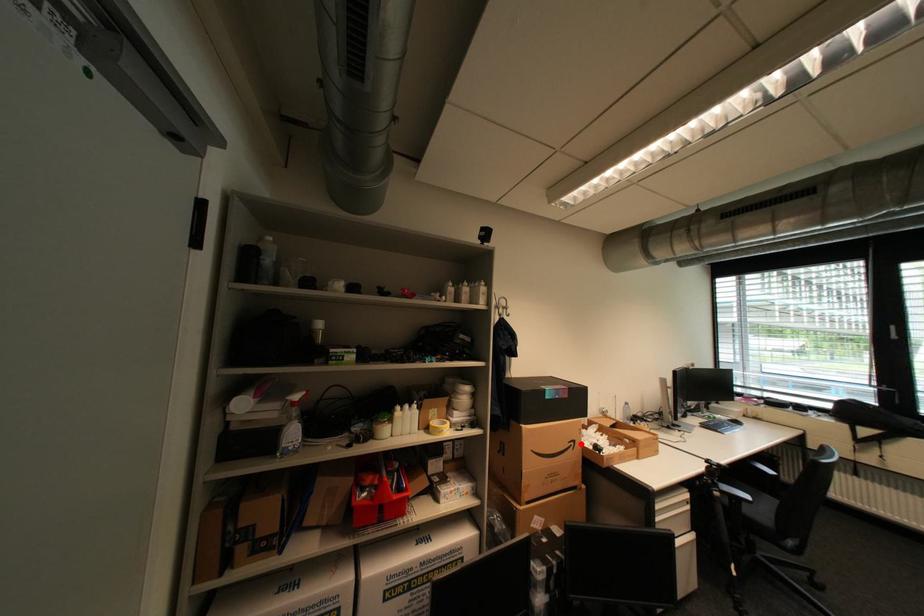
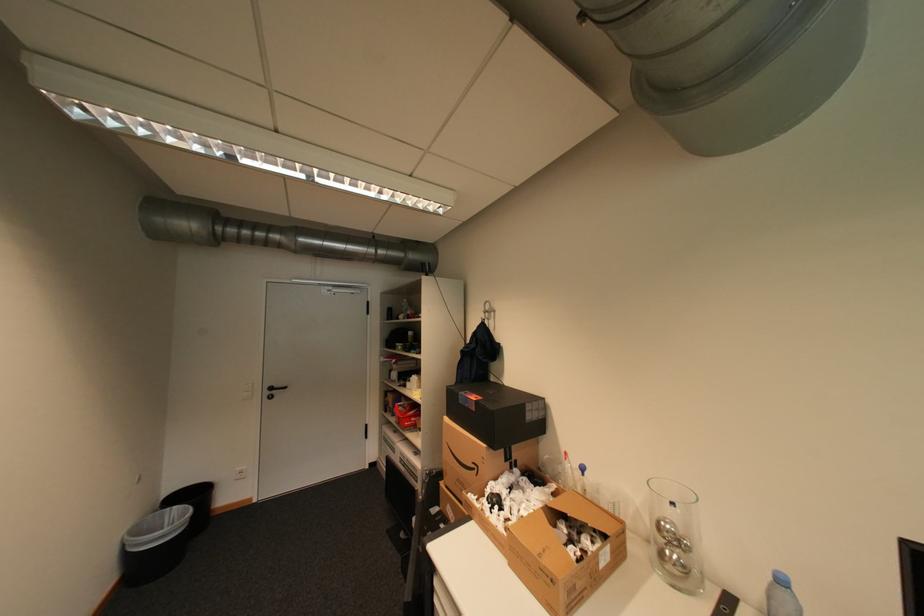
Question: A red point is marked in image1. In image2, is the corresponding 3D point closer to the camera or farther? Reply with the corresponding letter.

Choices:
 (A) The corresponding 3D point is closer.
 (B) The corresponding 3D point is farther.

Answer: (B)